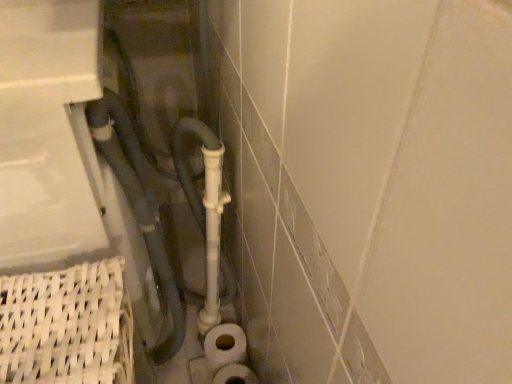
Question: Considering the relative positions of matte gray pipe at center and white matte toilet paper at lower center in the image provided, is matte gray pipe at center in front of white matte toilet paper at lower center?

Choices:
 (A) yes
 (B) no

Answer: (A)

Question: Is matte gray pipe at center wider than white matte toilet paper at lower center?

Choices:
 (A) no
 (B) yes

Answer: (B)

Question: Does matte gray pipe at center have a smaller size compared to white matte toilet paper at lower center?

Choices:
 (A) no
 (B) yes

Answer: (A)

Question: Is white matte toilet paper at lower center a part of matte gray pipe at center?

Choices:
 (A) no
 (B) yes

Answer: (A)

Question: Considering the relative sizes of matte gray pipe at center and white matte toilet paper at lower center in the image provided, is matte gray pipe at center thinner than white matte toilet paper at lower center?

Choices:
 (A) yes
 (B) no

Answer: (B)

Question: Is matte gray pipe at center facing away from white matte toilet paper at lower center?

Choices:
 (A) no
 (B) yes

Answer: (A)

Question: Is white matte toilet paper at lower center located outside matte gray pipe at center?

Choices:
 (A) no
 (B) yes

Answer: (B)

Question: Is white matte toilet paper at lower center thinner than matte gray pipe at center?

Choices:
 (A) no
 (B) yes

Answer: (B)

Question: Is white matte toilet paper at lower center to the right of matte gray pipe at center from the viewer's perspective?

Choices:
 (A) yes
 (B) no

Answer: (A)

Question: Is white matte toilet paper at lower center further to camera compared to matte gray pipe at center?

Choices:
 (A) no
 (B) yes

Answer: (B)

Question: Is white matte toilet paper at lower center directly adjacent to matte gray pipe at center?

Choices:
 (A) no
 (B) yes

Answer: (A)

Question: From the image's perspective, is white matte toilet paper at lower center over matte gray pipe at center?

Choices:
 (A) yes
 (B) no

Answer: (B)

Question: Looking at their shapes, would you say matte gray pipe at center is wider or thinner than white matte toilet paper at lower center?

Choices:
 (A) thin
 (B) wide

Answer: (B)